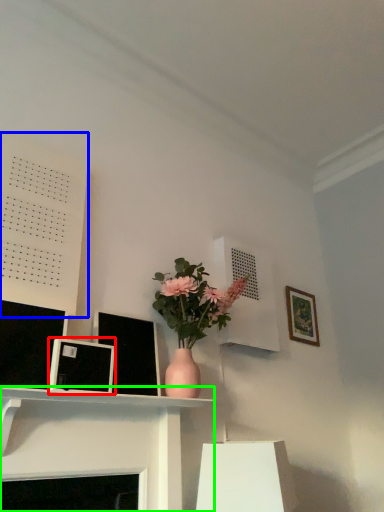
Question: Which is nearer to the picture frame (highlighted by a red box)? bulletin board (highlighted by a blue box) or shelf (highlighted by a green box).

Choices:
 (A) bulletin board
 (B) shelf

Answer: (B)